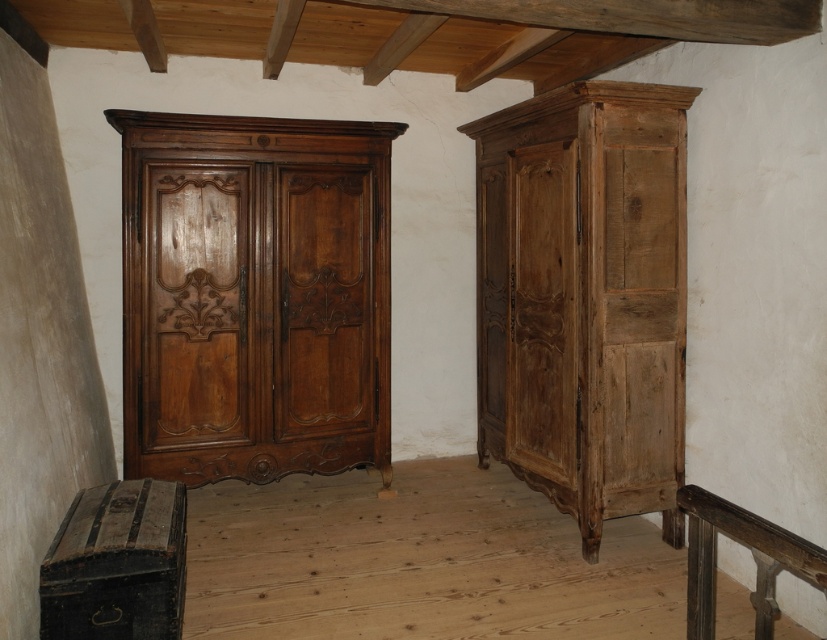
Is polished brown wood dresser at left smaller than natural wood dresser at right?

Indeed, polished brown wood dresser at left has a smaller size compared to natural wood dresser at right.

Between polished brown wood dresser at left and natural wood dresser at right, which one is positioned higher?

polished brown wood dresser at left is above.

Does point (227, 422) come in front of point (534, 234)?

No, it is behind (534, 234).

I want to click on polished brown wood dresser at left, so click(254, 296).

Is natural wood dresser at right further to the viewer compared to rustic wood balustrade at lower right?

That is True.

Can you confirm if natural wood dresser at right is wider than rustic wood balustrade at lower right?

Indeed, natural wood dresser at right has a greater width compared to rustic wood balustrade at lower right.

Find the location of a particular element. This screenshot has width=827, height=640. natural wood dresser at right is located at coordinates (584, 298).

Is point (352, 291) farther from camera compared to point (813, 548)?

Yes, point (352, 291) is farther from viewer.

Between point (333, 358) and point (699, 604), which one is positioned behind?

The point (333, 358) is behind.

Find the location of a particular element. This screenshot has width=827, height=640. polished brown wood dresser at left is located at coordinates (254, 296).